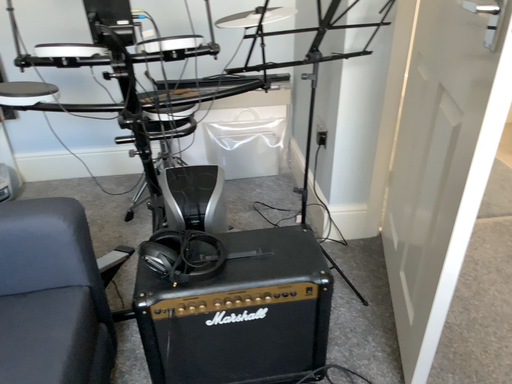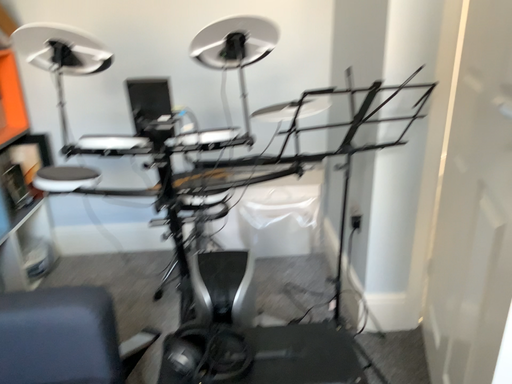
Question: How did the camera likely rotate when shooting the video?

Choices:
 (A) rotated downward
 (B) rotated upward

Answer: (B)